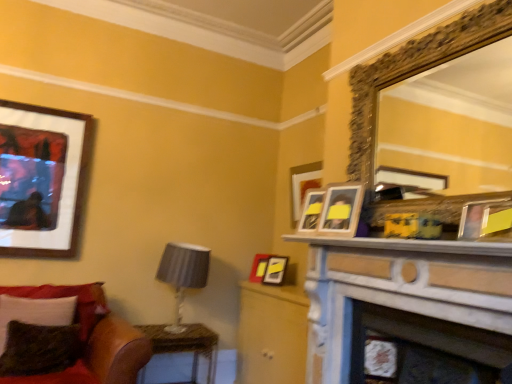
Question: Is gold ornate mirror at upper right positioned in front of matte yellow picture frame at upper right, which is the 1th picture frame from front to back?

Choices:
 (A) no
 (B) yes

Answer: (A)

Question: Is matte yellow picture frame at upper right, which is counted as the fifth picture frame, starting from the left, completely or partially inside gold ornate mirror at upper right?

Choices:
 (A) yes
 (B) no

Answer: (B)

Question: From the image's perspective, is gold ornate mirror at upper right above matte yellow picture frame at upper right, the 1th picture frame positioned from the right?

Choices:
 (A) no
 (B) yes

Answer: (B)

Question: Can we say gold ornate mirror at upper right lies outside matte yellow picture frame at upper right, marked as the 5th picture frame in a back-to-front arrangement?

Choices:
 (A) yes
 (B) no

Answer: (A)

Question: Does gold ornate mirror at upper right have a greater width compared to matte yellow picture frame at upper right, which is the 1th picture frame from front to back?

Choices:
 (A) yes
 (B) no

Answer: (A)

Question: Is matte black frame at upper left, which is counted as the 1th picture frame, starting from the left, taller or shorter than wooden table at lower left?

Choices:
 (A) short
 (B) tall

Answer: (B)

Question: Is matte black frame at upper left, acting as the 3th picture frame starting from the back, bigger or smaller than wooden table at lower left?

Choices:
 (A) big
 (B) small

Answer: (B)

Question: From the image's perspective, relative to wooden table at lower left, is matte black frame at upper left, acting as the 3th picture frame starting from the back, above or below?

Choices:
 (A) above
 (B) below

Answer: (A)

Question: Looking at their shapes, would you say matte black frame at upper left, which ranks as the 3th picture frame in front-to-back order, is wider or thinner than wooden table at lower left?

Choices:
 (A) thin
 (B) wide

Answer: (A)

Question: From a real-world perspective, is matte black frame at upper left, acting as the 3th picture frame starting from the back, above or below wooden photo frame at upper right, arranged as the fourth picture frame when viewed from the back?

Choices:
 (A) below
 (B) above

Answer: (B)

Question: From the image's perspective, relative to wooden photo frame at upper right, placed as the second picture frame when sorted from right to left, is matte black frame at upper left, acting as the 3th picture frame starting from the back, above or below?

Choices:
 (A) above
 (B) below

Answer: (A)

Question: Does point (86, 162) appear closer or farther from the camera than point (347, 233)?

Choices:
 (A) farther
 (B) closer

Answer: (A)

Question: Visually, is matte black frame at upper left, acting as the 3th picture frame starting from the back, positioned to the left or to the right of wooden photo frame at upper right, placed as the second picture frame when sorted from right to left?

Choices:
 (A) left
 (B) right

Answer: (A)

Question: In terms of size, does matte yellow picture frame at upper right, marked as the 5th picture frame in a back-to-front arrangement, appear bigger or smaller than gold ornate mirror at upper right?

Choices:
 (A) big
 (B) small

Answer: (B)

Question: From the image's perspective, is matte yellow picture frame at upper right, the 1th picture frame positioned from the right, positioned above or below gold ornate mirror at upper right?

Choices:
 (A) below
 (B) above

Answer: (A)